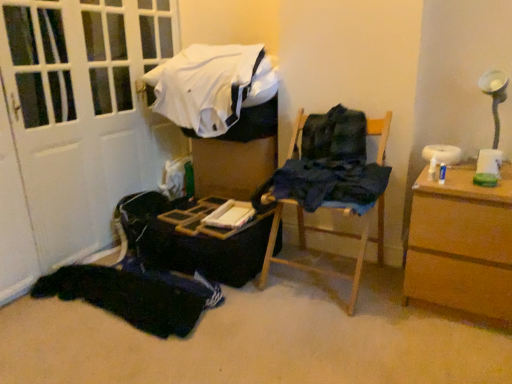
Question: Is brown wooden chest of drawers at right outside of black fabric at lower left, placed as the 1th clothing when sorted from bottom to top?

Choices:
 (A) yes
 (B) no

Answer: (A)

Question: Does brown wooden chest of drawers at right have a lesser height compared to black fabric at lower left, which appears as the 3th clothing when viewed from the top?

Choices:
 (A) yes
 (B) no

Answer: (B)

Question: Is brown wooden chest of drawers at right facing away from black fabric at lower left, placed as the 1th clothing when sorted from bottom to top?

Choices:
 (A) yes
 (B) no

Answer: (B)

Question: Does brown wooden chest of drawers at right have a larger size compared to black fabric at lower left, placed as the 1th clothing when sorted from bottom to top?

Choices:
 (A) yes
 (B) no

Answer: (A)

Question: Can you confirm if brown wooden chest of drawers at right is positioned to the left of black fabric at lower left, placed as the 1th clothing when sorted from bottom to top?

Choices:
 (A) no
 (B) yes

Answer: (A)

Question: Considering the relative sizes of brown wooden chest of drawers at right and black fabric at lower left, which appears as the 3th clothing when viewed from the top, in the image provided, is brown wooden chest of drawers at right wider than black fabric at lower left, which appears as the 3th clothing when viewed from the top,?

Choices:
 (A) no
 (B) yes

Answer: (A)

Question: Is white cotton shirt at upper center, the 1th clothing from the top, at the back of wooden chair at center?

Choices:
 (A) yes
 (B) no

Answer: (B)

Question: Considering the relative positions of wooden chair at center and white cotton shirt at upper center, the 1th clothing from the top, in the image provided, is wooden chair at center to the right of white cotton shirt at upper center, the 1th clothing from the top, from the viewer's perspective?

Choices:
 (A) yes
 (B) no

Answer: (A)

Question: From a real-world perspective, is wooden chair at center beneath white cotton shirt at upper center, the 1th clothing from the top?

Choices:
 (A) yes
 (B) no

Answer: (A)

Question: Considering the relative positions of wooden chair at center and white cotton shirt at upper center, the 1th clothing from the top, in the image provided, is wooden chair at center in front of white cotton shirt at upper center, the 1th clothing from the top,?

Choices:
 (A) no
 (B) yes

Answer: (B)

Question: From the image's perspective, is wooden chair at center beneath white cotton shirt at upper center, the 1th clothing from the top?

Choices:
 (A) yes
 (B) no

Answer: (A)

Question: Considering the relative sizes of wooden chair at center and white cotton shirt at upper center, acting as the 3th clothing starting from the bottom, in the image provided, is wooden chair at center wider than white cotton shirt at upper center, acting as the 3th clothing starting from the bottom,?

Choices:
 (A) no
 (B) yes

Answer: (A)

Question: From a real-world perspective, is white cotton shirt at upper center, acting as the 3th clothing starting from the bottom, located higher than dark blue fabric at center, acting as the 2th clothing starting from the bottom?

Choices:
 (A) no
 (B) yes

Answer: (B)